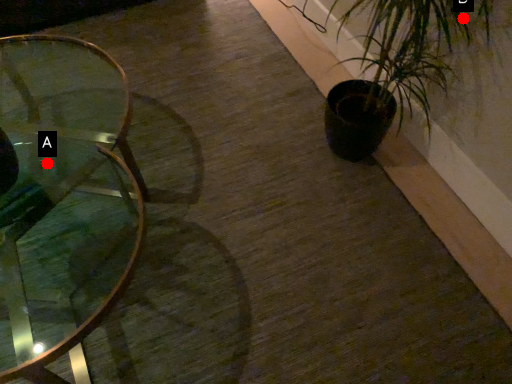
Question: Two points are circled on the image, labeled by A and B beside each circle. Which point is closer to the camera taking this photo?

Choices:
 (A) A is closer
 (B) B is closer

Answer: (B)